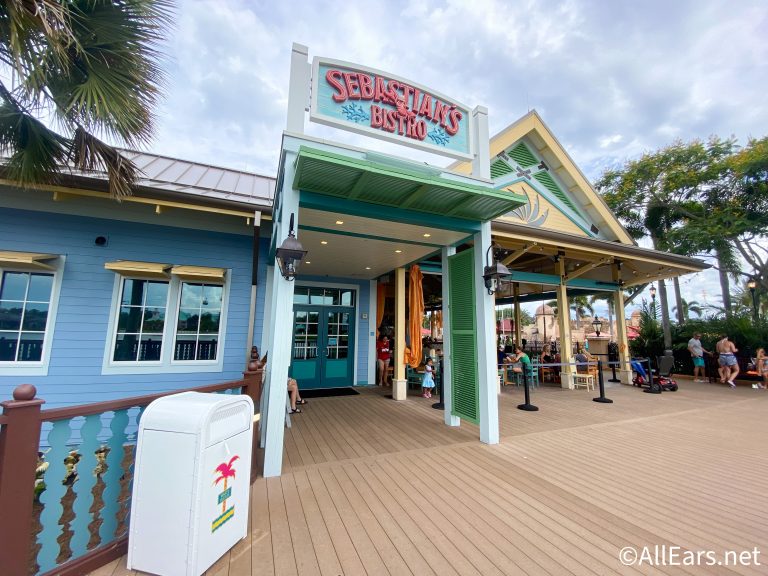
Identify the location of window. (12, 288), (133, 295), (192, 299).